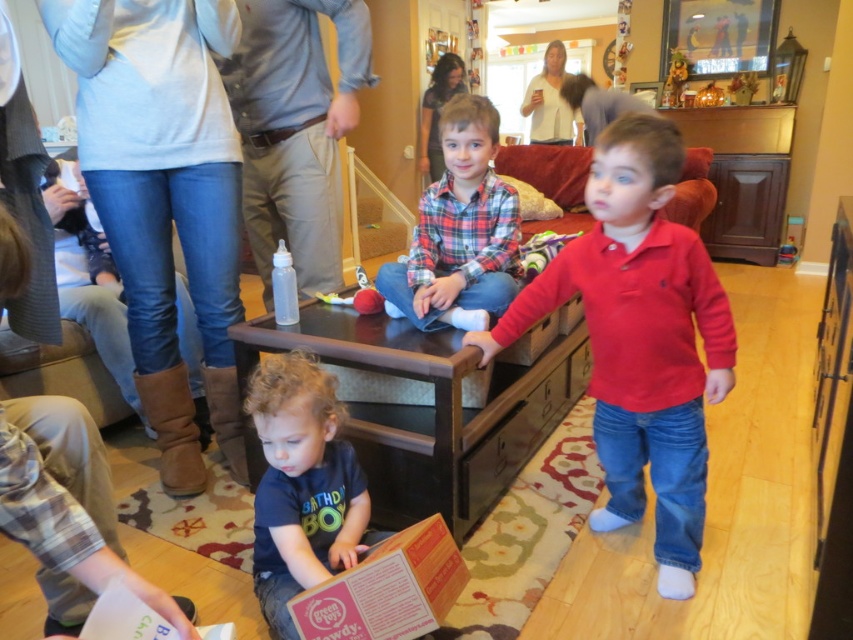
You are standing in the living room and see the point marked at coordinates (640,339). What object is located at this point?

The point at coordinates (640,339) corresponds to the red cotton shirt at center.